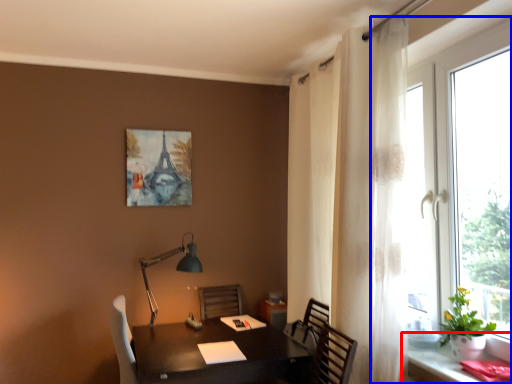
Question: Which of the following is the farthest to the observer, computer desk (highlighted by a red box) or window (highlighted by a blue box)?

Choices:
 (A) computer desk
 (B) window

Answer: (B)